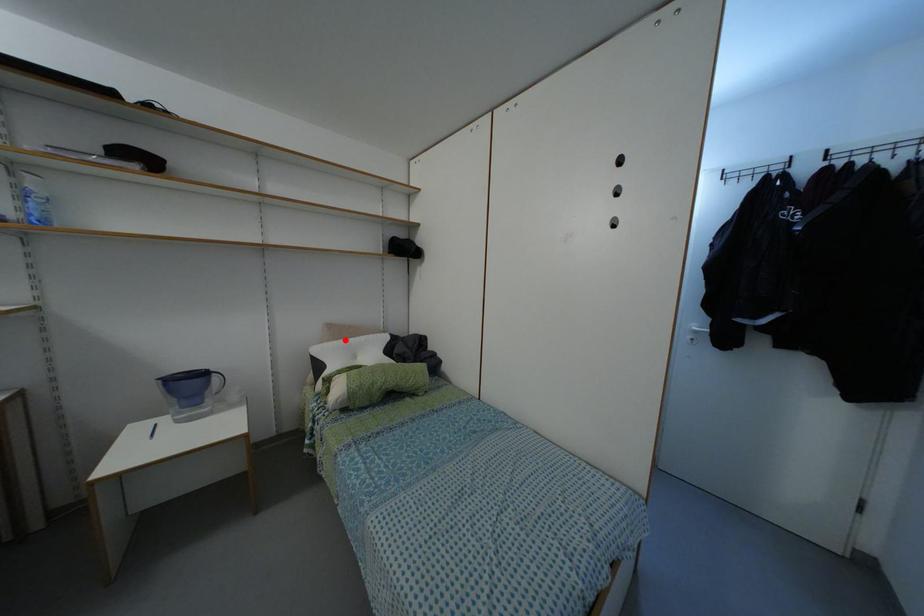
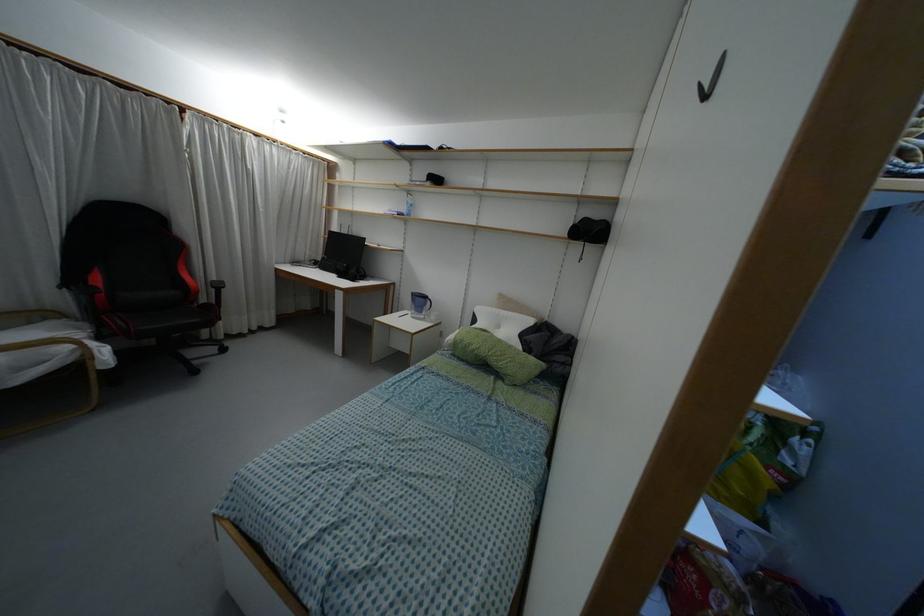
In the second image, find the point that corresponds to the highlighted location in the first image.

(496, 310)